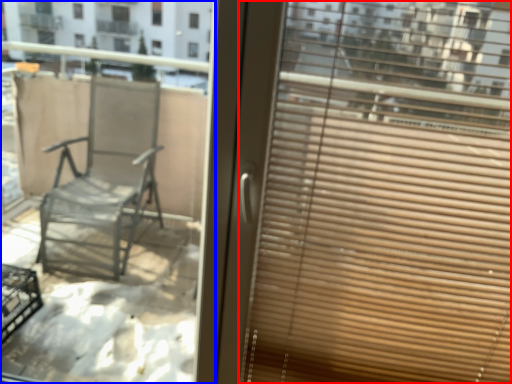
Question: Among these objects, which one is nearest to the camera, window blind (highlighted by a red box) or window (highlighted by a blue box)?

Choices:
 (A) window blind
 (B) window

Answer: (A)